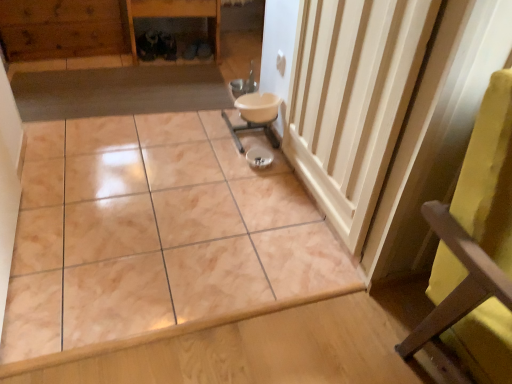
At what (x,y) coordinates should I click in order to perform the action: click on vacant space that is to the left of white glossy sink at center. Please return your answer as a coordinate pair (x, y). Looking at the image, I should click on (189, 129).